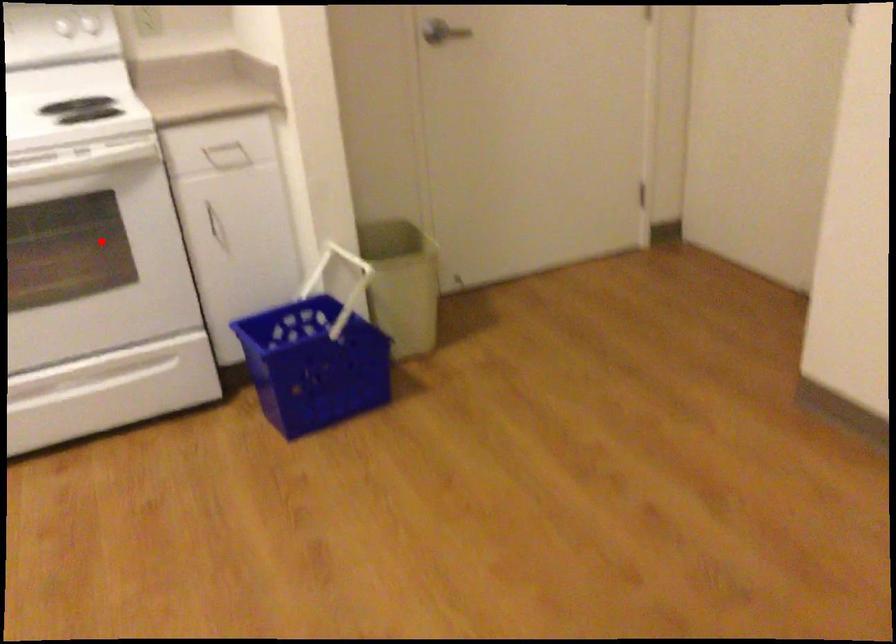
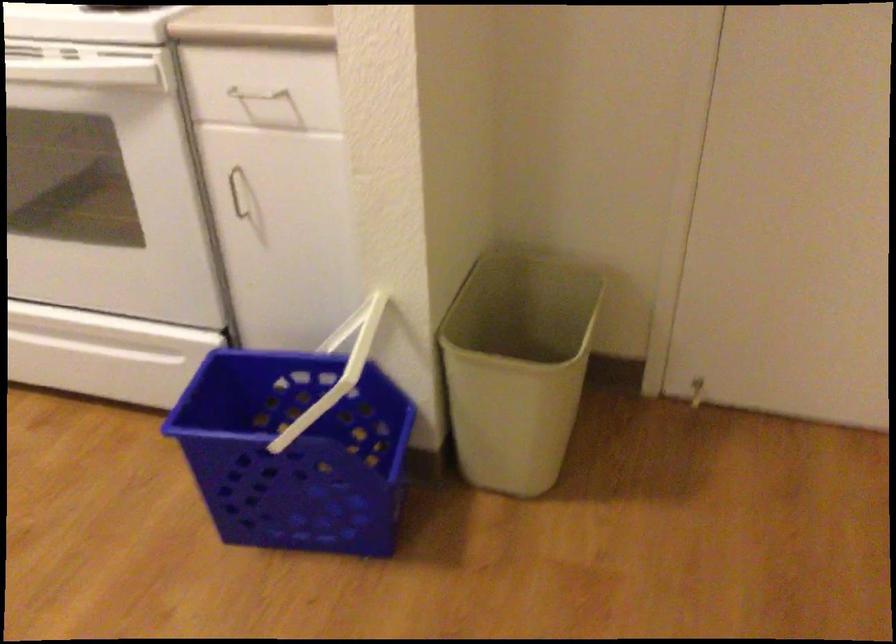
Question: A red point is marked in image1. In image2, is the corresponding 3D point closer to the camera or farther? Reply with the corresponding letter.

Choices:
 (A) The corresponding 3D point is closer.
 (B) The corresponding 3D point is farther.

Answer: (A)